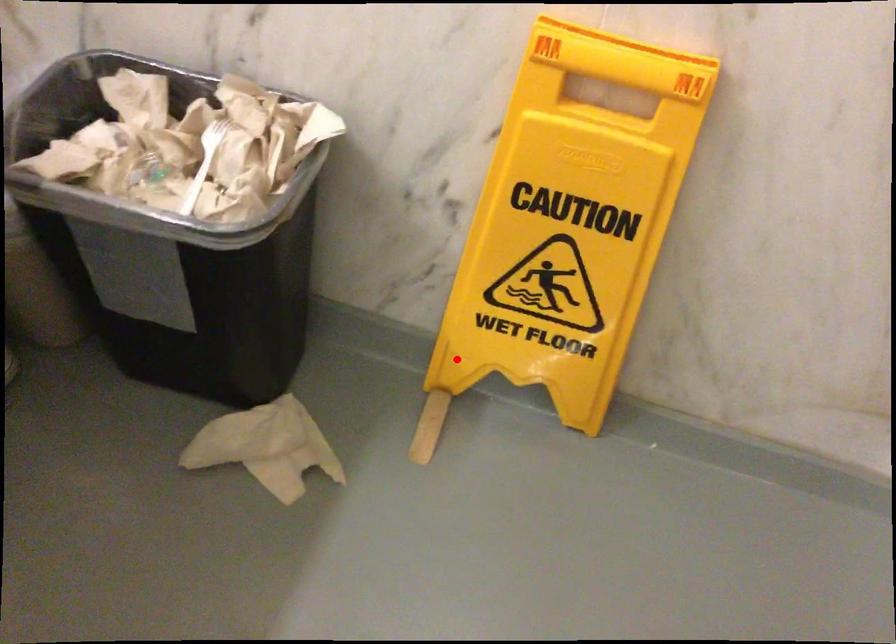
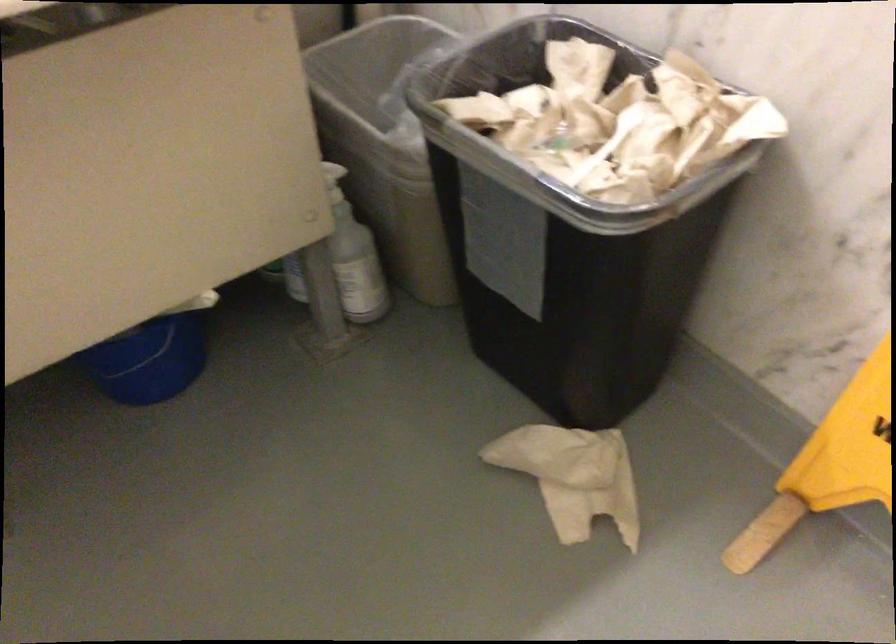
Question: I am providing you with two images of the same scene from different viewpoints. A red point is marked on the first image. At the location where the point appears in image 1, is it still visible in image 2?

Choices:
 (A) Yes
 (B) No

Answer: (A)